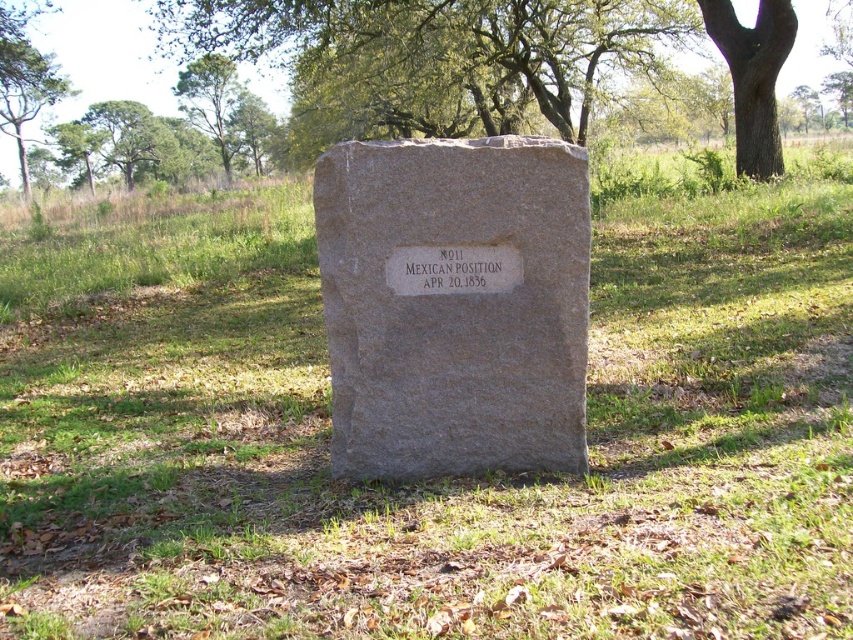
Question: Among these objects, which one is nearest to the camera?

Choices:
 (A) etched stone plaque at center
 (B) gray stone gravestone at center

Answer: (B)

Question: Which point appears farthest from the camera in this image?

Choices:
 (A) (238, 86)
 (B) (747, 150)

Answer: (A)

Question: Which of these objects is positioned farthest from the green leafy tree at upper left?

Choices:
 (A) smooth brown bark at upper right
 (B) gray stone gravestone at center

Answer: (B)

Question: Is gray stone gravestone at center positioned in front of smooth brown bark at upper right?

Choices:
 (A) no
 (B) yes

Answer: (B)

Question: Can you confirm if green leafy tree at upper left is positioned below etched stone plaque at center?

Choices:
 (A) no
 (B) yes

Answer: (A)

Question: Is gray stone gravestone at center to the left of etched stone plaque at center from the viewer's perspective?

Choices:
 (A) no
 (B) yes

Answer: (B)